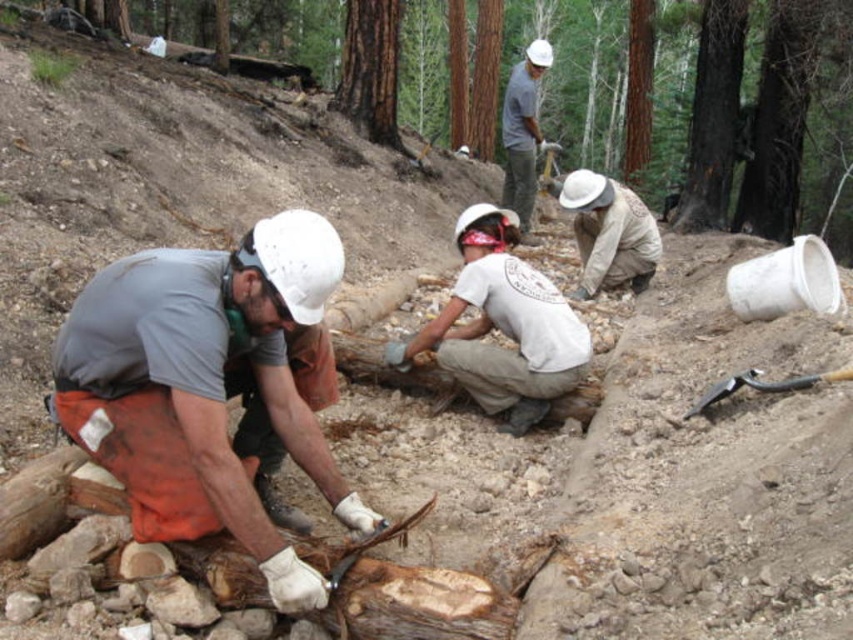
You are a safety inspector assessing the scene. You notice the camouflage fabric shirt at center and the white matte helmet at upper center. Which object has a smaller width when viewed from above?

The camouflage fabric shirt at center has a smaller width than the white matte helmet at upper center when viewed from above.

Looking at this image, you are a safety inspector assessing the scene. You notice the camouflage fabric shirt at center and the white matte helmet at upper center. Which object takes up more area in the image?

The white matte helmet at upper center occupies more space than the camouflage fabric shirt at center.

You are a drone operator trying to capture aerial footage of the forest clearing. You need to fly your drone from the camera position to a specific point. Which of the two points, point (543, 323) or point (515, 90), will the drone reach first if it flies straight towards both points simultaneously?

The drone will reach point (543, 323) first because it is closer to the camera than point (515, 90).